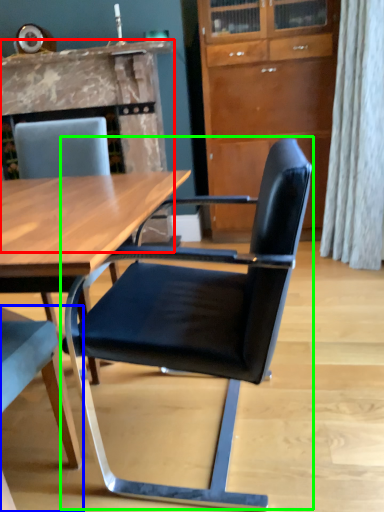
Question: Which object is positioned closest to fireplace (highlighted by a red box)? Select from chair (highlighted by a blue box) and chair (highlighted by a green box).

Choices:
 (A) chair
 (B) chair

Answer: (B)